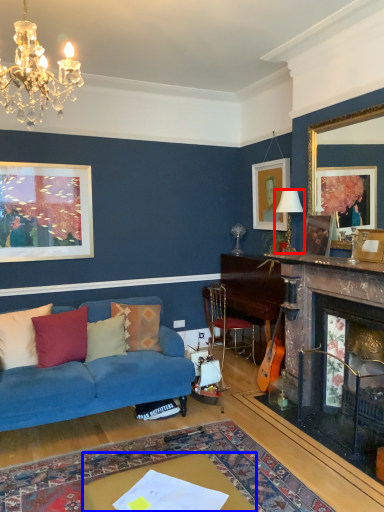
Question: Which object is further to the camera taking this photo, lamp (highlighted by a red box) or table (highlighted by a blue box)?

Choices:
 (A) lamp
 (B) table

Answer: (A)